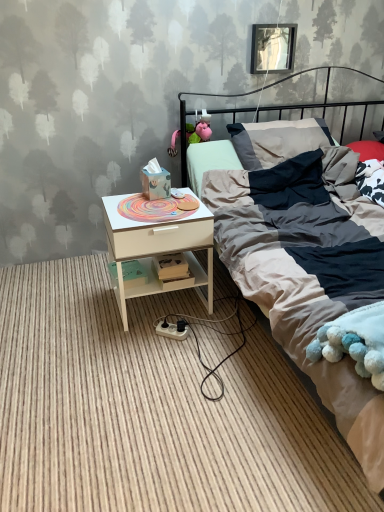
Question: Can you confirm if textured cotton bed at center is shorter than metallic rectangular frame at upper center?

Choices:
 (A) yes
 (B) no

Answer: (B)

Question: Is the depth of textured cotton bed at center less than that of metallic rectangular frame at upper center?

Choices:
 (A) yes
 (B) no

Answer: (A)

Question: From a real-world perspective, is textured cotton bed at center on metallic rectangular frame at upper center?

Choices:
 (A) yes
 (B) no

Answer: (B)

Question: Is textured cotton bed at center not inside metallic rectangular frame at upper center?

Choices:
 (A) no
 (B) yes

Answer: (B)

Question: Does textured cotton bed at center lie behind metallic rectangular frame at upper center?

Choices:
 (A) no
 (B) yes

Answer: (A)

Question: From their relative heights in the image, would you say textured cotton bed at center is taller or shorter than white wood nightstand at lower left?

Choices:
 (A) short
 (B) tall

Answer: (B)

Question: Considering their positions, is textured cotton bed at center located in front of or behind white wood nightstand at lower left?

Choices:
 (A) front
 (B) behind

Answer: (A)

Question: Visually, is textured cotton bed at center positioned to the left or to the right of white wood nightstand at lower left?

Choices:
 (A) left
 (B) right

Answer: (B)

Question: Is point (276, 267) closer or farther from the camera than point (180, 214)?

Choices:
 (A) closer
 (B) farther

Answer: (A)

Question: From a real-world perspective, relative to metallic rectangular frame at upper center, is white wood nightstand at lower left vertically above or below?

Choices:
 (A) above
 (B) below

Answer: (B)

Question: Considering the positions of white wood nightstand at lower left and metallic rectangular frame at upper center in the image, is white wood nightstand at lower left wider or thinner than metallic rectangular frame at upper center?

Choices:
 (A) wide
 (B) thin

Answer: (A)

Question: From the image's perspective, is white wood nightstand at lower left positioned above or below metallic rectangular frame at upper center?

Choices:
 (A) above
 (B) below

Answer: (B)

Question: Is white wood nightstand at lower left to the left or to the right of metallic rectangular frame at upper center in the image?

Choices:
 (A) right
 (B) left

Answer: (B)

Question: From their relative heights in the image, would you say white wood nightstand at lower left is taller or shorter than textured cotton bed at center?

Choices:
 (A) tall
 (B) short

Answer: (B)

Question: Is point (91, 295) closer or farther from the camera than point (314, 145)?

Choices:
 (A) farther
 (B) closer

Answer: (B)